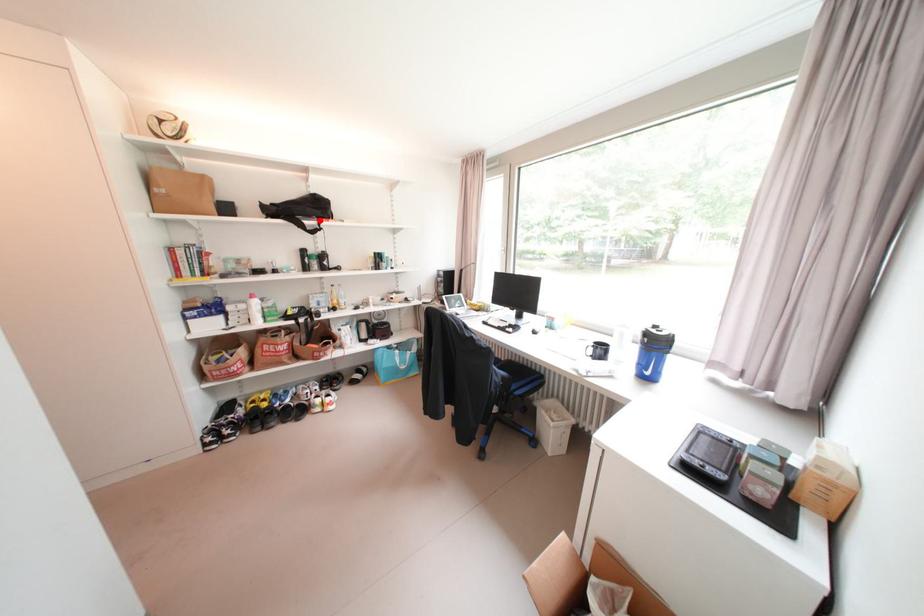
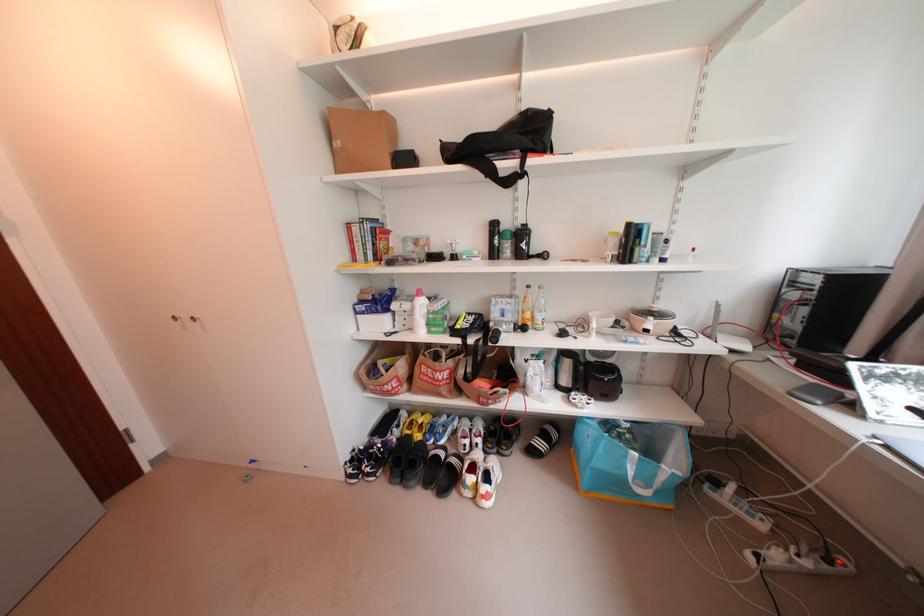
Locate, in the second image, the point that corresponds to the highlighted location in the first image.

(518, 158)